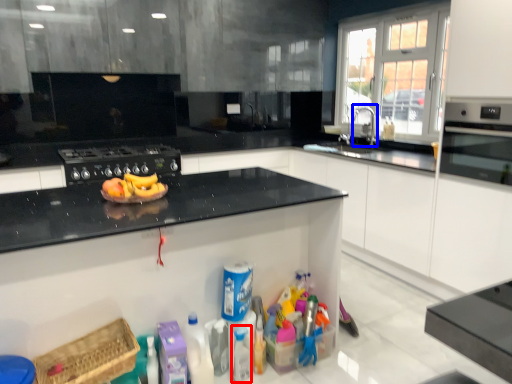
Question: Which object appears closest to the camera in this image, bottle (highlighted by a red box) or faucet (highlighted by a blue box)?

Choices:
 (A) bottle
 (B) faucet

Answer: (A)